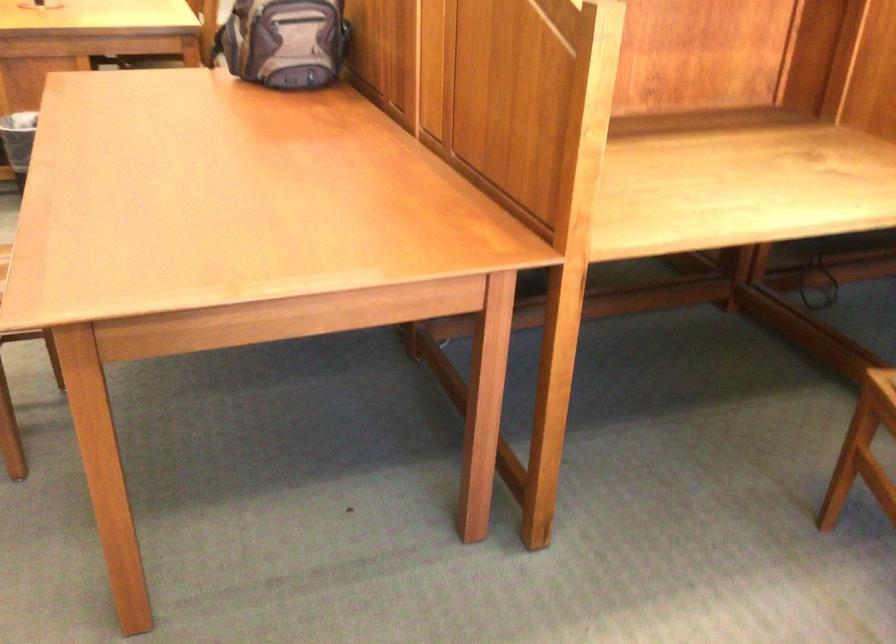
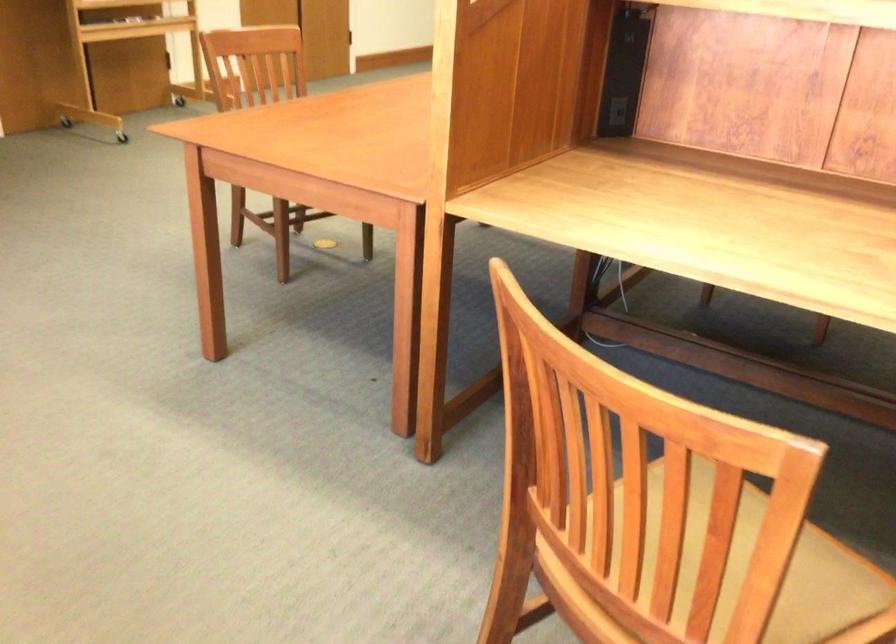
Where in the second image is the point corresponding to (x=457, y=104) from the first image?

(616, 111)